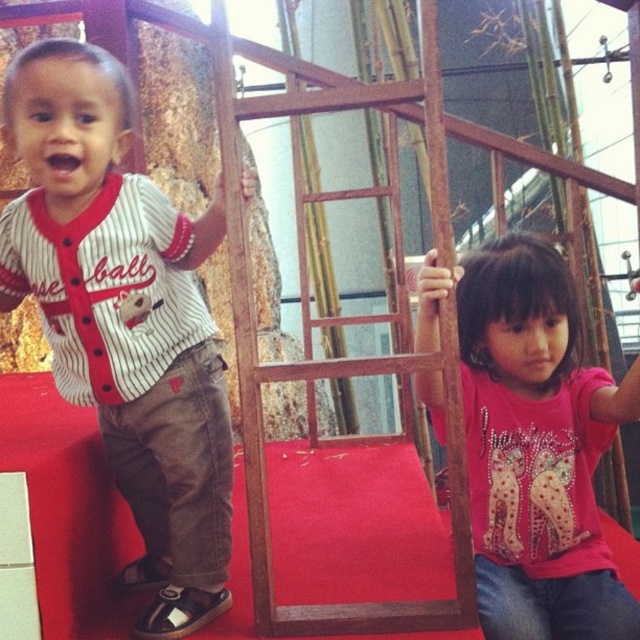
You are a parent observing the two children playing on the play structure. You notice two specific points marked on the structure. The first point is at coordinates point (x=180, y=577) and the second is at point (x=532, y=320). From your perspective, which point is closer to you?

Point (x=180, y=577) is in front of point (x=532, y=320), so it is closer to you.

Based on the photo, you are a photographer taking a picture of the white striped jersey at left and the pink glittery shirt at center. Which one should you focus on first to ensure both are in focus?

The white striped jersey at left is closer to the viewer than the pink glittery shirt at center, so focus on the white striped jersey at left first to ensure both are in focus.

You are a photographer taking a picture of the white striped jersey at left and the pink glittery shirt at center. Which one should you focus on first if you want to capture both in the frame?

You should focus on the white striped jersey at left first because it is positioned on the left side of the pink glittery shirt at center, so starting from the left ensures both are in the frame.